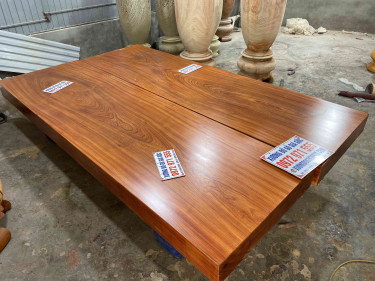
Identify the location of column. The height and width of the screenshot is (281, 375). (256, 21).